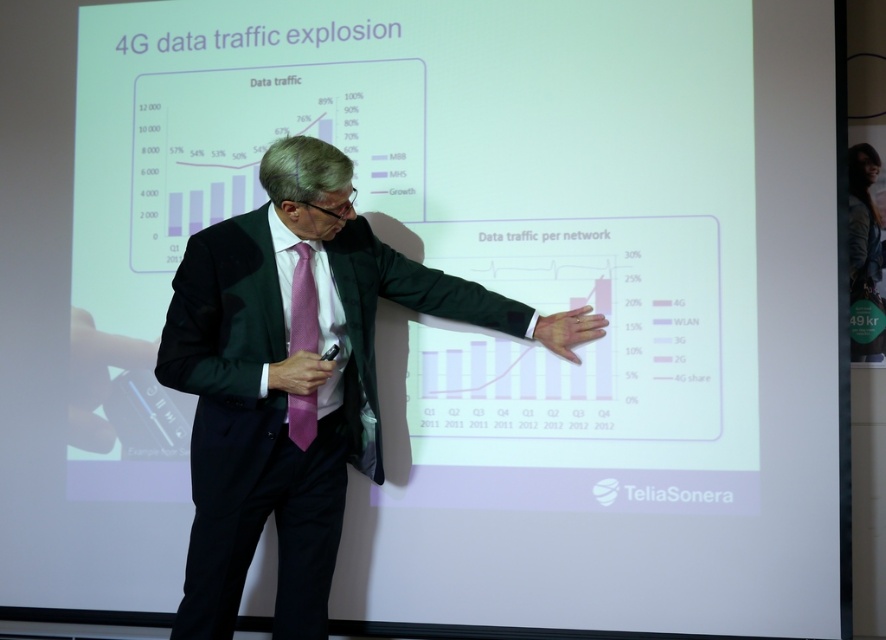
Which of these two, matte green suit at center or pink textured tie at center, stands shorter?

pink textured tie at center

Does matte green suit at center have a larger size compared to pink textured tie at center?

Indeed, matte green suit at center has a larger size compared to pink textured tie at center.

Between point (231, 531) and point (307, 348), which one is positioned in front?

Point (231, 531) is more forward.

Identify the location of matte green suit at center. (296, 380).